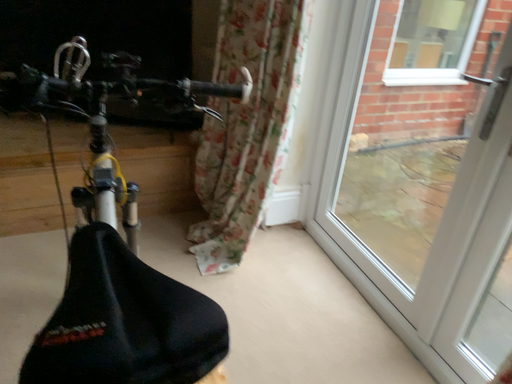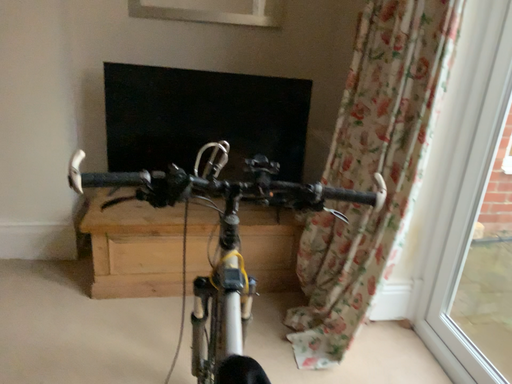
Question: Which way did the camera rotate in the video?

Choices:
 (A) rotated downward
 (B) rotated upward

Answer: (B)